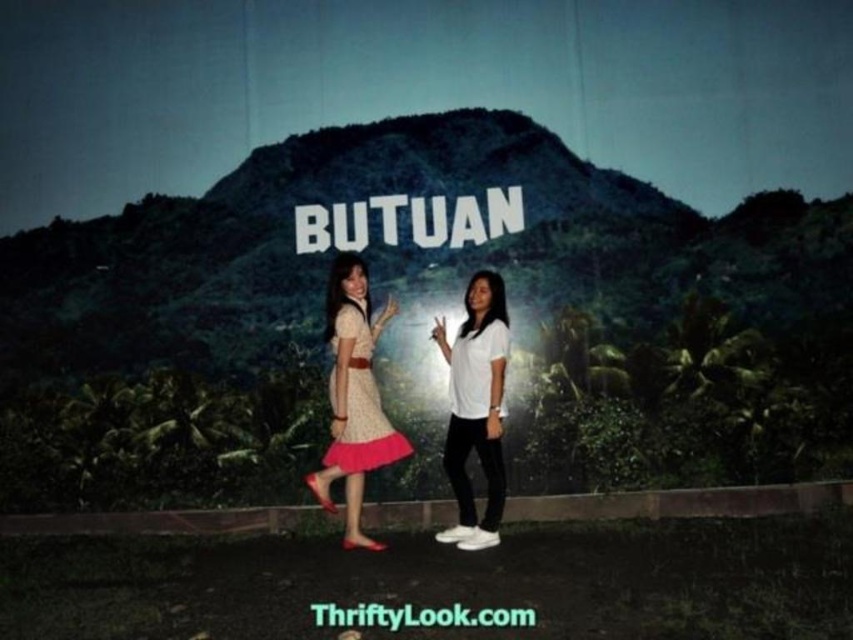
Does polka dot fabric dress at center have a smaller size compared to white matte shirt at center?

No.

Does polka dot fabric dress at center appear on the left side of white matte shirt at center?

Yes, polka dot fabric dress at center is to the left of white matte shirt at center.

Between point (387, 429) and point (480, 397), which one is positioned behind?

The point (387, 429) is more distant.

This screenshot has width=853, height=640. I want to click on polka dot fabric dress at center, so click(x=354, y=396).

Does matte white sign at center lie in front of white matte shirt at center?

That is False.

Which is in front, point (123, 20) or point (445, 339)?

Point (445, 339)

Locate an element on the screen. The image size is (853, 640). matte white sign at center is located at coordinates (416, 88).

Which is below, matte white sign at center or polka dot fabric dress at center?

polka dot fabric dress at center

Can you confirm if matte white sign at center is positioned to the right of polka dot fabric dress at center?

In fact, matte white sign at center is to the left of polka dot fabric dress at center.

Where is `matte white sign at center`? Image resolution: width=853 pixels, height=640 pixels. matte white sign at center is located at coordinates (416, 88).